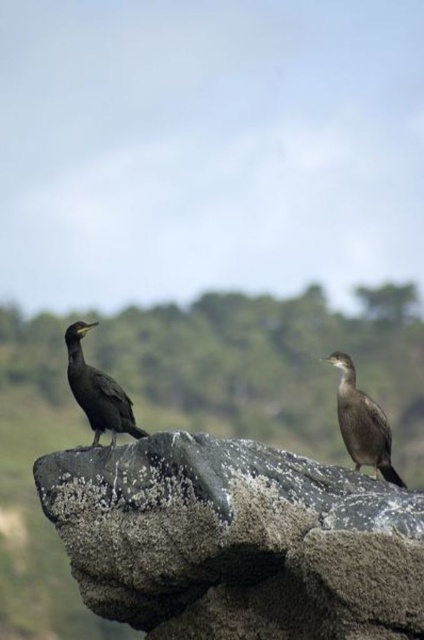
You are a birdwatcher trying to identify two birds on a rock. You notice both have dark brown feathers at right and dark brown feathers at left. Which bird has shorter dark brown feathers?

The dark brown feathers at right are shorter than the dark brown feathers at left.